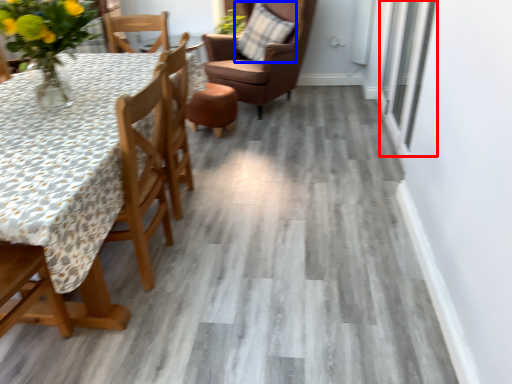
Question: Among these objects, which one is nearest to the camera, window (highlighted by a red box) or pillow (highlighted by a blue box)?

Choices:
 (A) window
 (B) pillow

Answer: (A)